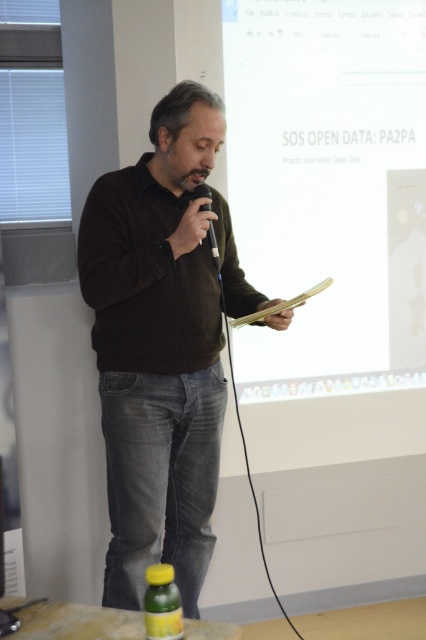
Question: Among these objects, which one is farthest from the camera?

Choices:
 (A) green matte bottle at lower center
 (B) black plastic microphone at center
 (C) white matte projection screen at upper center

Answer: (C)

Question: Can you confirm if white matte projection screen at upper center is positioned to the right of brown matte sweater at center?

Choices:
 (A) no
 (B) yes

Answer: (B)

Question: Considering the real-world distances, which object is closest to the brown matte sweater at center?

Choices:
 (A) white matte projection screen at upper center
 (B) green matte bottle at lower center
 (C) black plastic microphone at center

Answer: (C)

Question: Which is farther from the black plastic microphone at center?

Choices:
 (A) green matte bottle at lower center
 (B) white matte projection screen at upper center

Answer: (A)

Question: Can you confirm if brown matte sweater at center is positioned below black plastic microphone at center?

Choices:
 (A) yes
 (B) no

Answer: (A)

Question: Where is green matte bottle at lower center located in relation to black plastic microphone at center in the image?

Choices:
 (A) below
 (B) above

Answer: (A)